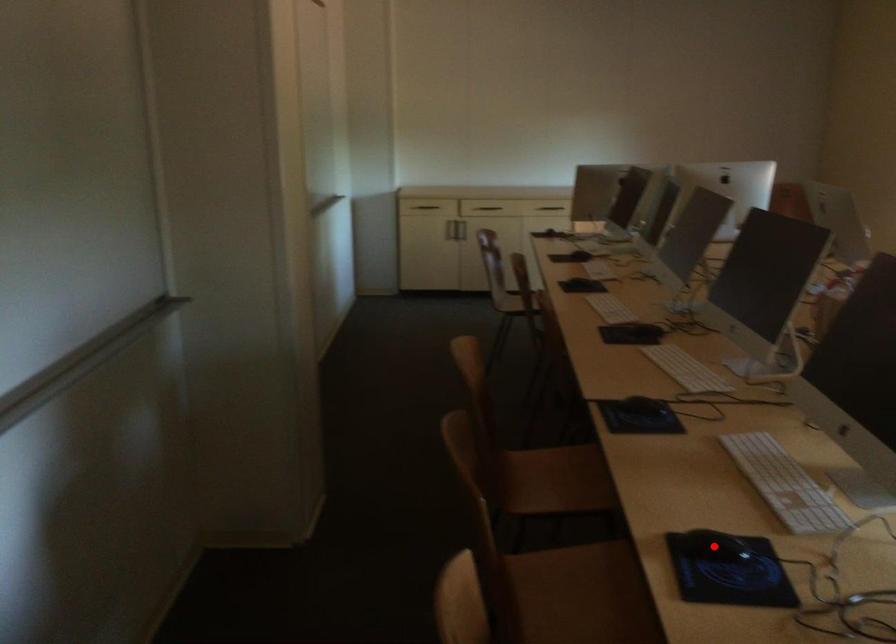
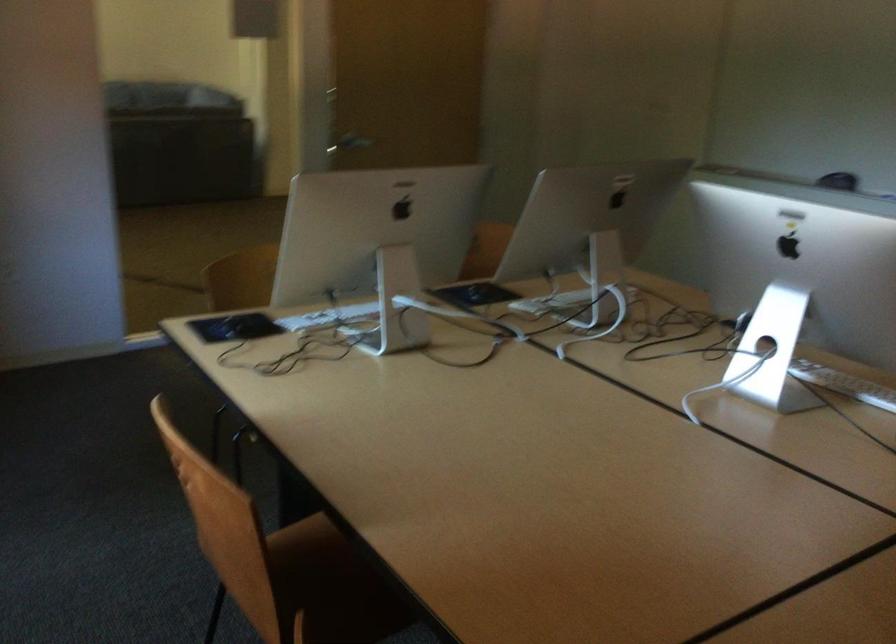
Question: I am providing you with two images of the same scene from different viewpoints. A red point is marked on the first image. At the location where the point appears in image 1, is it still visible in image 2?

Choices:
 (A) Yes
 (B) No

Answer: (B)